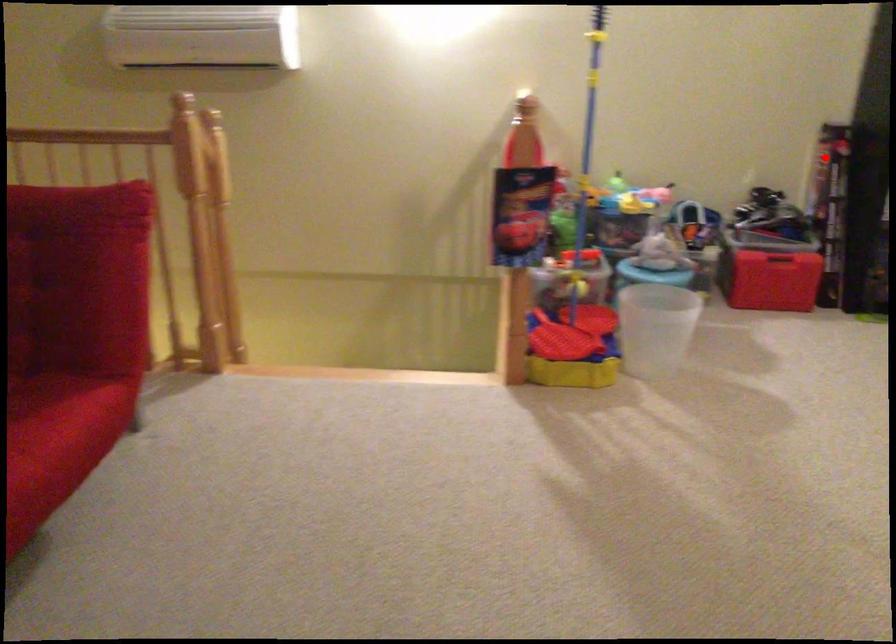
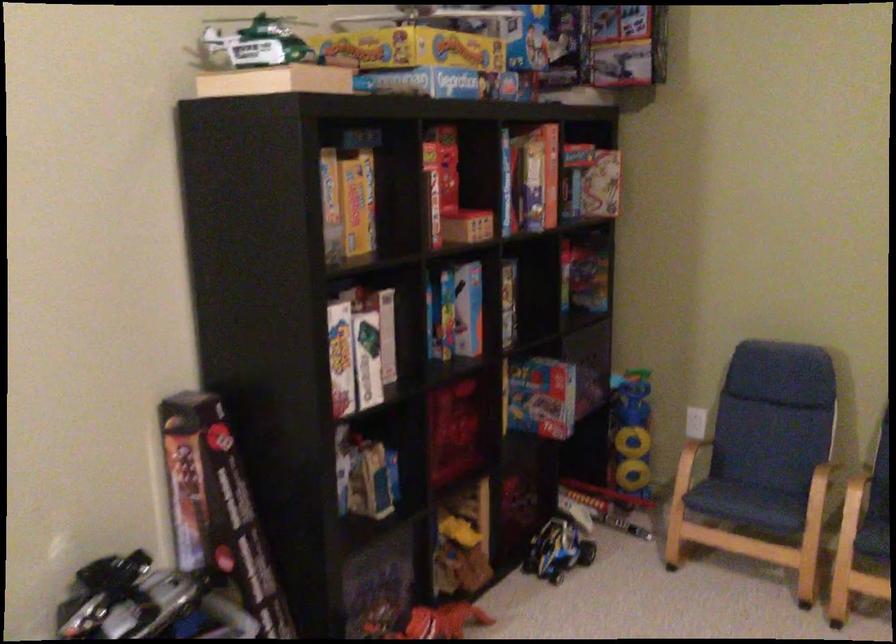
The point at the highlighted location is marked in the first image. Where is the corresponding point in the second image?

(186, 471)